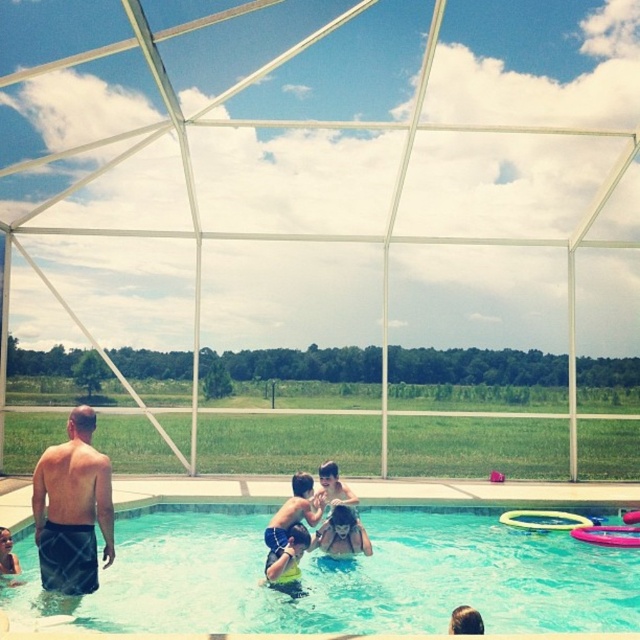
Is point (56, 451) positioned behind point (264, 564)?

No, it is in front of (264, 564).

Is dark blue shorts at lower left closer to the viewer compared to yellow-green swimsuit at center?

Yes, dark blue shorts at lower left is closer to the viewer.

Between point (108, 488) and point (284, 577), which one is positioned in front?

Point (108, 488) is more forward.

This screenshot has height=640, width=640. Identify the location of dark blue shorts at lower left. (72, 508).

Does blue glossy water at center appear on the left side of yellow-green swimsuit at center?

No, blue glossy water at center is not to the left of yellow-green swimsuit at center.

Who is more forward, (452, 593) or (289, 570)?

Point (289, 570) is in front.

Locate an element on the screen. This screenshot has width=640, height=640. blue glossy water at center is located at coordinates (362, 579).

Is dark blue shorts at lower left further to camera compared to yellow rubber ring at center?

No.

Who is shorter, dark blue shorts at lower left or yellow rubber ring at center?

With less height is yellow rubber ring at center.

At what (x,y) coordinates should I click in order to perform the action: click on dark blue shorts at lower left. Please return your answer as a coordinate pair (x, y). The width and height of the screenshot is (640, 640). Looking at the image, I should click on (72, 508).